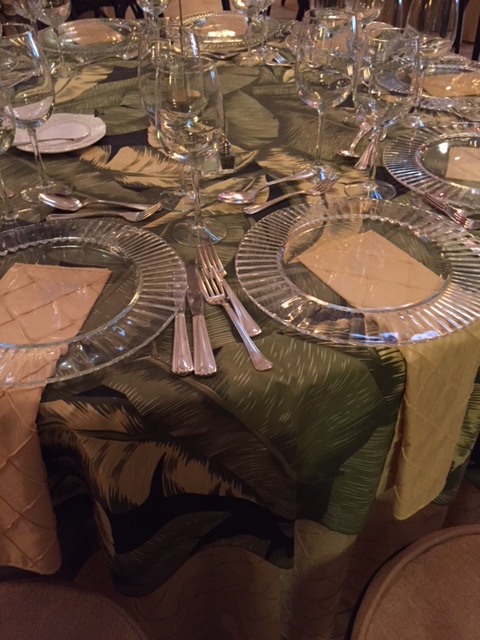
Find the location of a particular element. clear plate is located at coordinates (90, 42), (215, 28), (442, 77), (438, 164), (340, 264), (97, 294).